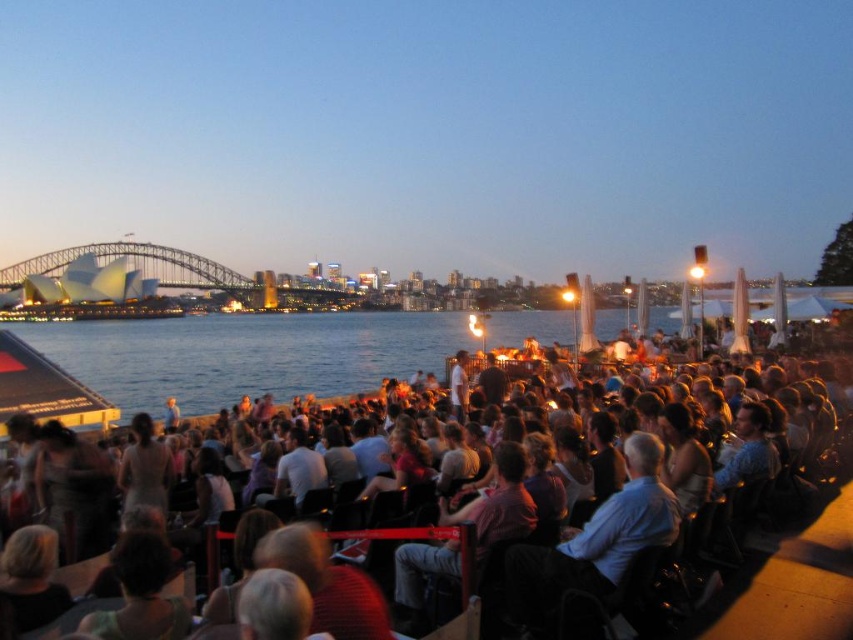
From the picture: You are standing at the point marked as point (x=245, y=355) in the image. What do you see directly in front of you?

You see dark blue water at center directly in front of you at point (x=245, y=355).

You are standing at the point with coordinates point (134, 364) and want to move towards the point with coordinates point (311, 364). Which direction should you move to get there?

You should move away from the viewer because point (311, 364) is further away than point (134, 364).